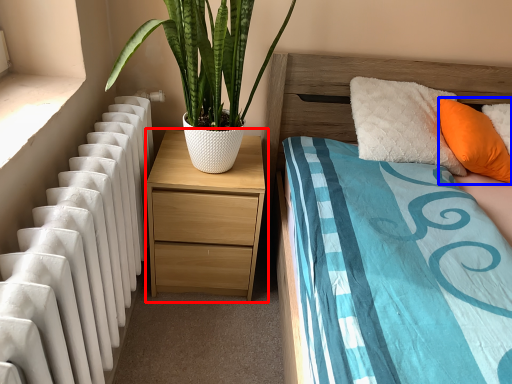
Question: Which object is closer to the camera taking this photo, nightstand (highlighted by a red box) or pillow (highlighted by a blue box)?

Choices:
 (A) nightstand
 (B) pillow

Answer: (B)